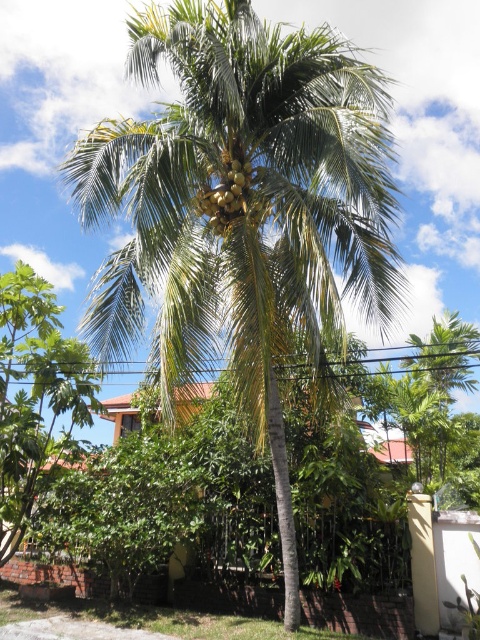
Does green leafy coconut tree at center appear on the left side of green matte coconut at center?

Yes, green leafy coconut tree at center is to the left of green matte coconut at center.

Can you confirm if green leafy coconut tree at center is smaller than green matte coconut at center?

Incorrect, green leafy coconut tree at center is not smaller in size than green matte coconut at center.

Between point (214, 352) and point (240, 157), which one is positioned behind?

Point (240, 157)

Identify the location of green leafy coconut tree at center. This screenshot has height=640, width=480. (247, 211).